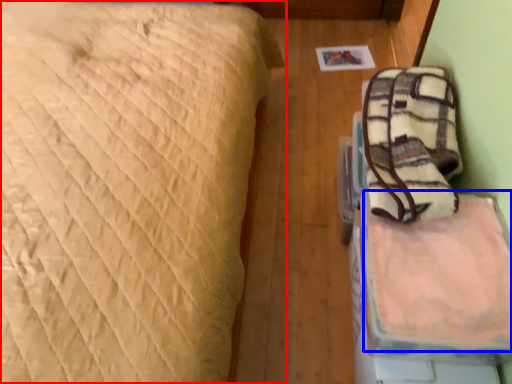
Question: Which point is closer to the camera, bed (highlighted by a red box) or sheet (highlighted by a blue box)?

Choices:
 (A) bed
 (B) sheet

Answer: (A)